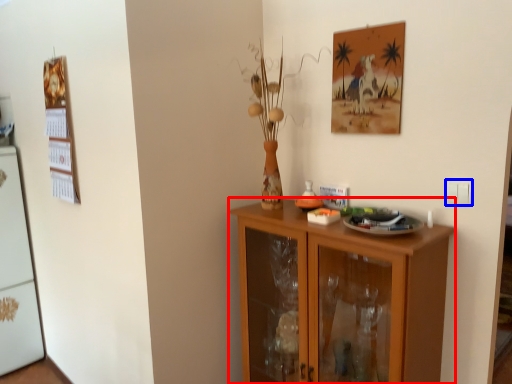
Question: Among these objects, which one is nearest to the camera, cabinetry (highlighted by a red box) or electric outlet (highlighted by a blue box)?

Choices:
 (A) cabinetry
 (B) electric outlet

Answer: (A)